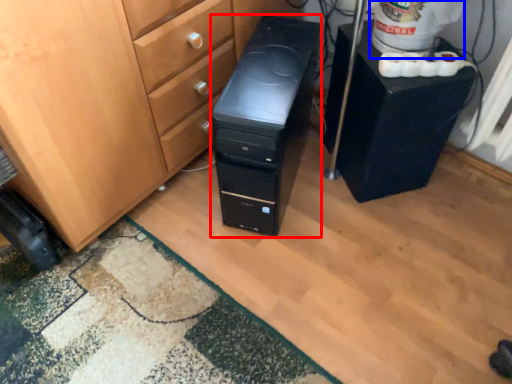
Question: Which object is closer to the camera taking this photo, computer tower (highlighted by a red box) or water cooler (highlighted by a blue box)?

Choices:
 (A) computer tower
 (B) water cooler

Answer: (A)